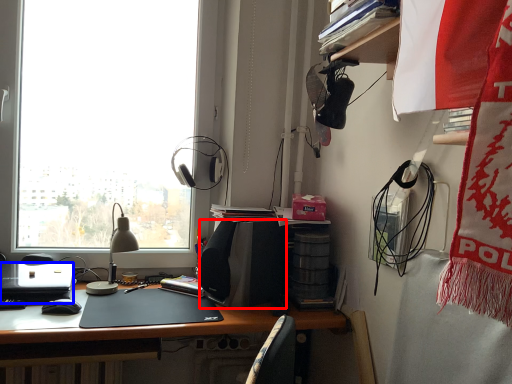
Question: Which of the following is the farthest to the observer, loudspeaker (highlighted by a red box) or laptop (highlighted by a blue box)?

Choices:
 (A) loudspeaker
 (B) laptop

Answer: (A)